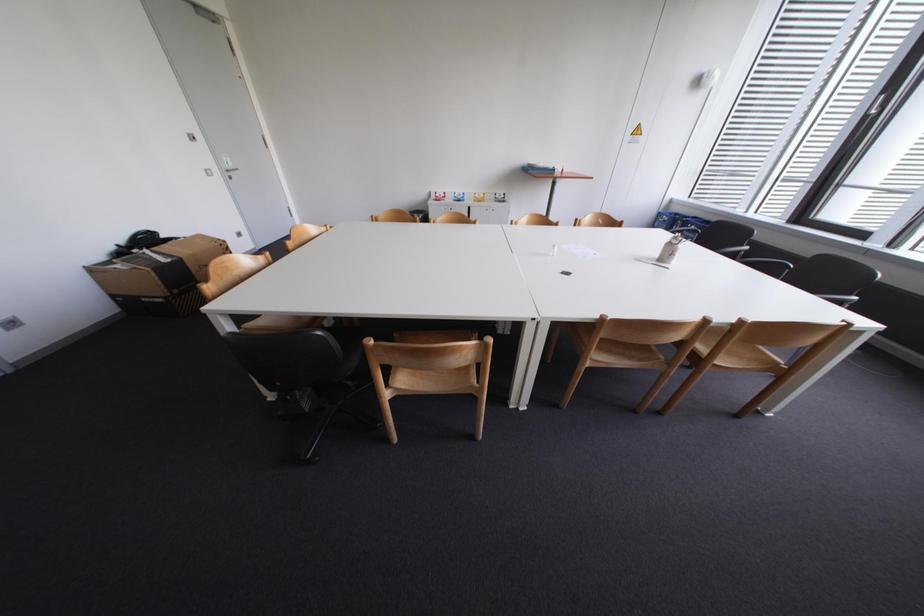
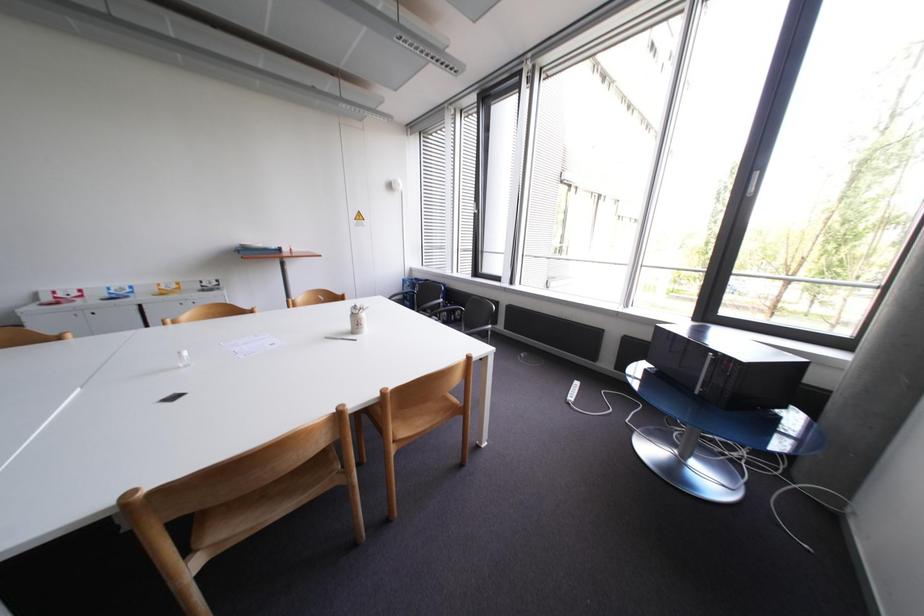
Question: Based on the continuous images, in which direction is the camera rotating? Reply with the corresponding letter.

Choices:
 (A) Left
 (B) Right
 (C) Up
 (D) Down

Answer: (B)